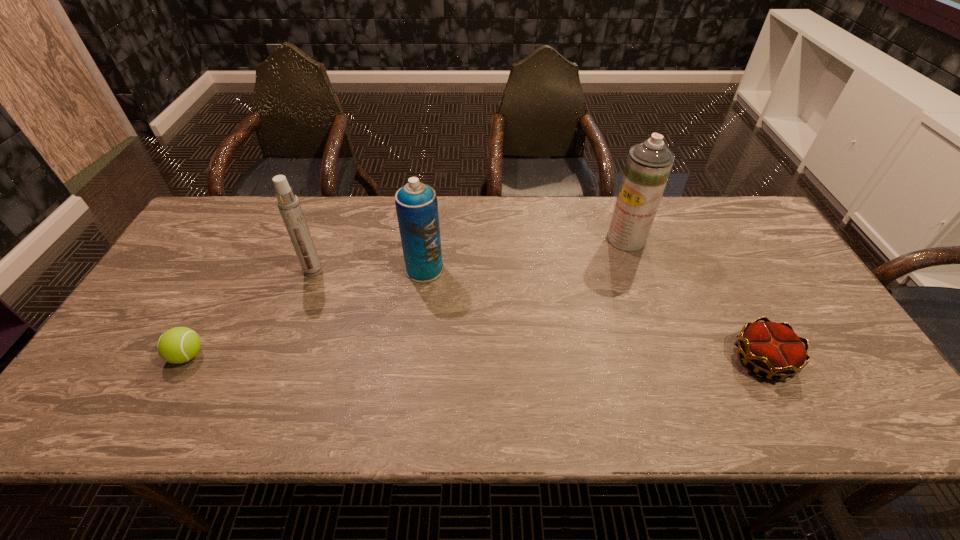
Find the location of a particular element. The width and height of the screenshot is (960, 540). object that can be found as the second closest to the crown is located at coordinates (416, 204).

You are a GUI agent. You are given a task and a screenshot of the screen. Output one action in this format:
    pyautogui.click(x=<x>, y=<y>)
    Task: Click on the third closest aerosol can to the tennis ball
    The width and height of the screenshot is (960, 540).
    Given the screenshot: What is the action you would take?
    pyautogui.click(x=648, y=166)

Identify which aerosol can is the nearest to the second aerosol can from right to left. Please provide its 2D coordinates. Your answer should be formatted as a tuple, i.e. [(x, y)], where the tuple contains the x and y coordinates of a point satisfying the conditions above.

[(288, 203)]

At what (x,y) coordinates should I click in order to perform the action: click on free region that satisfies the following two spatial constraints: 1. on the front side of the leftmost aerosol can; 2. on the right side of the crown. Please return your answer as a coordinate pair (x, y). The width and height of the screenshot is (960, 540). Looking at the image, I should click on (280, 360).

Locate an element on the screen. Image resolution: width=960 pixels, height=540 pixels. vacant region that satisfies the following two spatial constraints: 1. on the front side of the rightmost object; 2. on the right side of the second aerosol can from right to left is located at coordinates (414, 360).

Identify the location of free space that satisfies the following two spatial constraints: 1. on the back side of the leftmost aerosol can; 2. on the left side of the second aerosol can from left to right. This screenshot has height=540, width=960. (314, 269).

The width and height of the screenshot is (960, 540). Identify the location of vacant space that satisfies the following two spatial constraints: 1. on the back side of the second aerosol can from right to left; 2. on the right side of the fourth object from right to left. (314, 269).

Find the location of a particular element. The width and height of the screenshot is (960, 540). vacant space that satisfies the following two spatial constraints: 1. on the back side of the second object from right to left; 2. on the left side of the second object from left to right is located at coordinates (325, 239).

Image resolution: width=960 pixels, height=540 pixels. What are the coordinates of `vacant point that satisfies the following two spatial constraints: 1. on the back side of the leftmost aerosol can; 2. on the right side of the second aerosol can from right to left` in the screenshot? It's located at (314, 269).

At what (x,y) coordinates should I click in order to perform the action: click on free point that satisfies the following two spatial constraints: 1. on the front side of the third object from left to right; 2. on the left side of the crown. Please return your answer as a coordinate pair (x, y). The width and height of the screenshot is (960, 540). Looking at the image, I should click on click(414, 360).